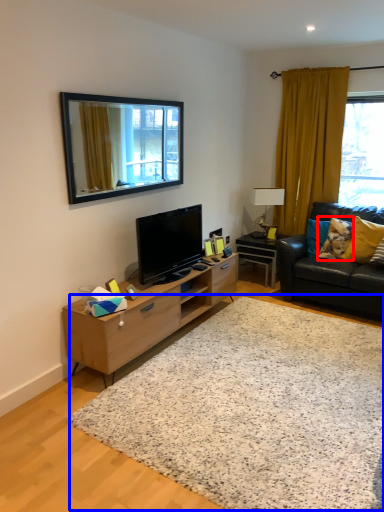
Question: Which object is further to the camera taking this photo, pillow (highlighted by a red box) or plain (highlighted by a blue box)?

Choices:
 (A) pillow
 (B) plain

Answer: (A)